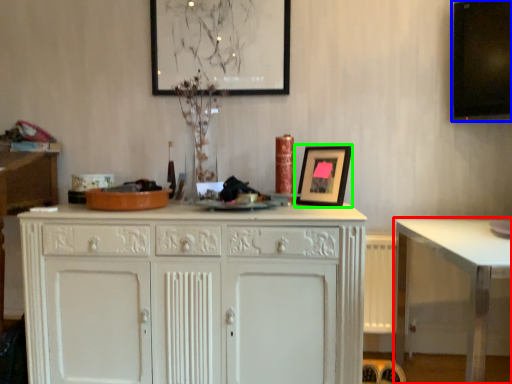
Question: Based on their relative distances, which object is nearer to table (highlighted by a red box)? Choose from computer monitor (highlighted by a blue box) and picture frame (highlighted by a green box).

Choices:
 (A) computer monitor
 (B) picture frame

Answer: (B)